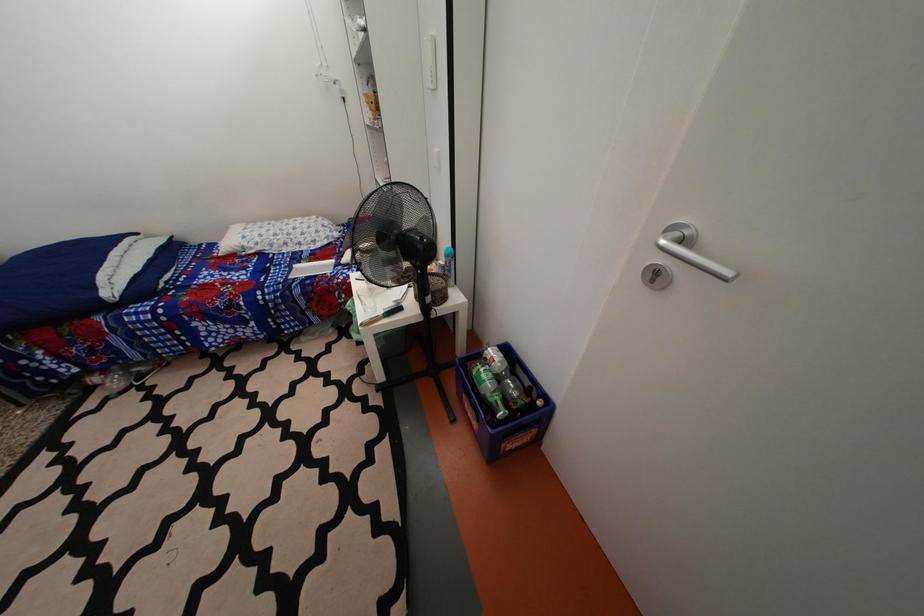
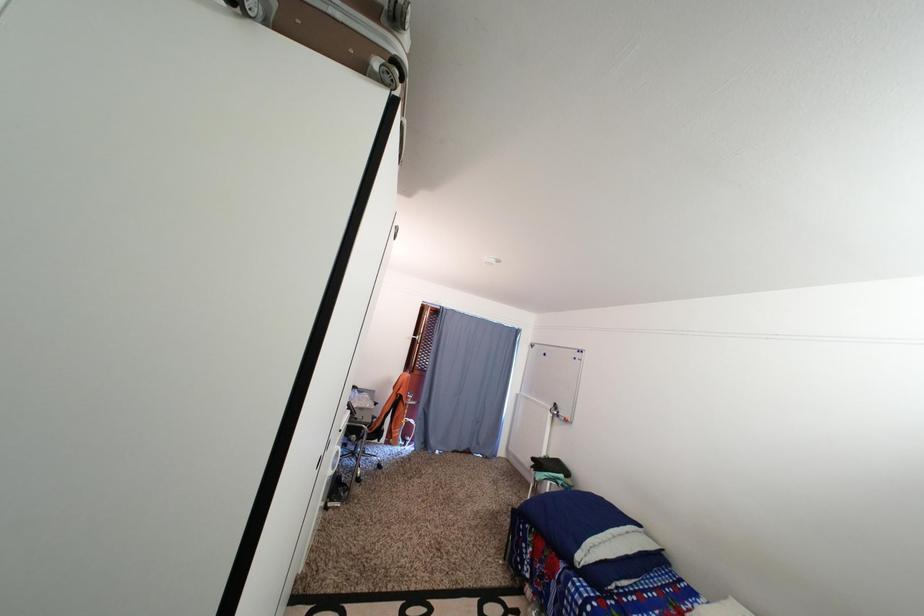
Question: The camera is either moving clockwise (left) or counter-clockwise (right) around the object. The first image is from the beginning of the video and the second image is from the end. Is the camera moving left or right when shooting the video?

Choices:
 (A) Left
 (B) Right

Answer: (B)